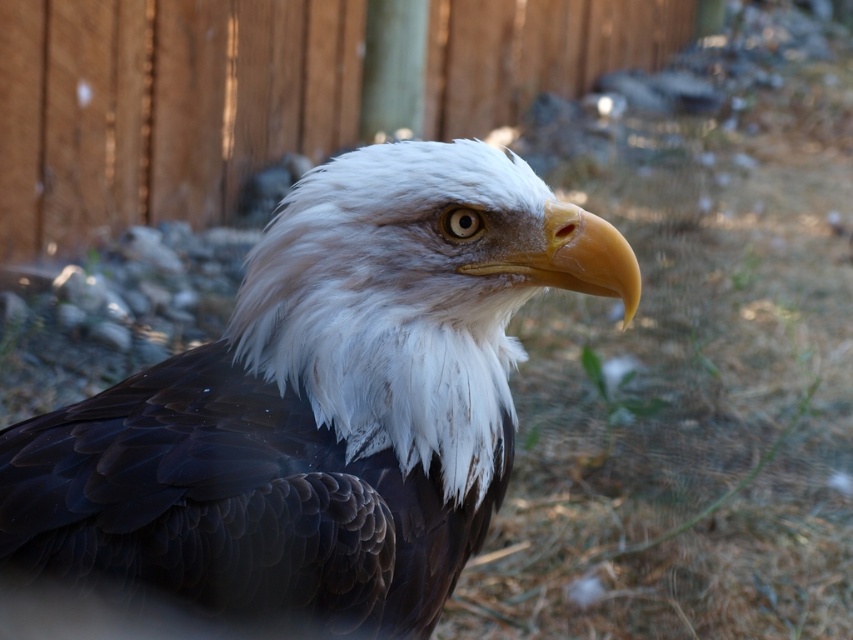
Question: Estimate the real-world distances between objects in this image. Which object is farther from the yellow glossy beak at center?

Choices:
 (A) dark brown feathers at center
 (B) wooden fence at upper center

Answer: (B)

Question: Does dark brown feathers at center appear on the right side of yellow glossy beak at center?

Choices:
 (A) yes
 (B) no

Answer: (B)

Question: Which of the following is the farthest from the observer?

Choices:
 (A) wooden fence at upper center
 (B) dark brown feathers at center

Answer: (A)

Question: Is dark brown feathers at center to the left of wooden fence at upper center from the viewer's perspective?

Choices:
 (A) no
 (B) yes

Answer: (A)

Question: Is the position of dark brown feathers at center less distant than that of wooden fence at upper center?

Choices:
 (A) no
 (B) yes

Answer: (B)

Question: Which point is farther from the camera taking this photo?

Choices:
 (A) (x=477, y=230)
 (B) (x=474, y=74)
 (C) (x=601, y=220)

Answer: (B)